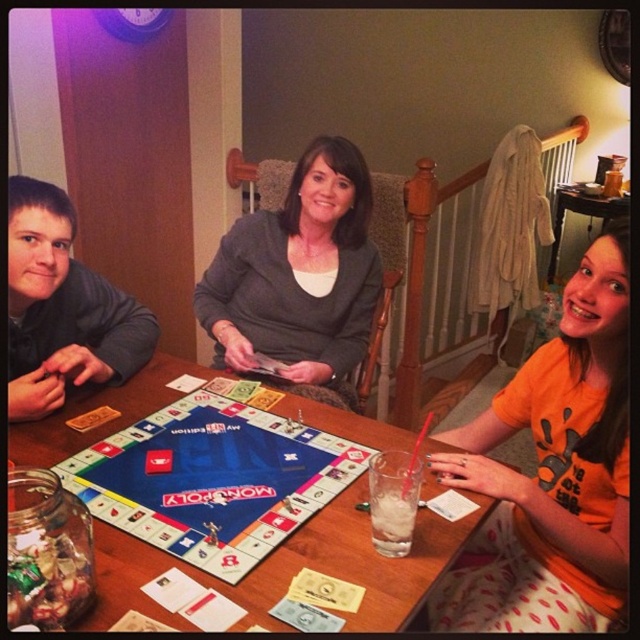
Question: Does orange cotton t-shirt at lower right appear on the left side of wooden table at center?

Choices:
 (A) yes
 (B) no

Answer: (A)

Question: Is gray sweater at center bigger than dark gray sweater at left?

Choices:
 (A) yes
 (B) no

Answer: (A)

Question: Among these points, which one is nearest to the camera?

Choices:
 (A) (624, 205)
 (B) (19, 388)
 (C) (486, 435)
 (D) (307, 541)

Answer: (D)

Question: Which of the following is the farthest from the observer?

Choices:
 (A) gray sweater at center
 (B) clear glass at table center

Answer: (A)

Question: Which point is farther from the camera taking this photo?

Choices:
 (A) (346, 353)
 (B) (612, 424)
 (C) (116, 584)
 (D) (404, 500)

Answer: (A)

Question: Observing the image, what is the correct spatial positioning of clear glass at table center in reference to wooden table at center?

Choices:
 (A) below
 (B) above

Answer: (A)